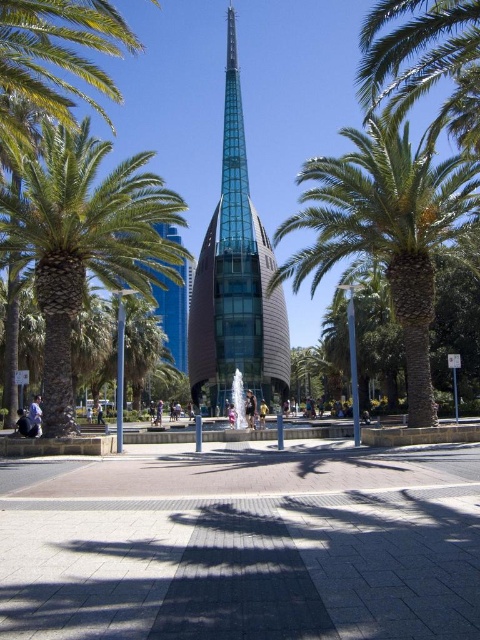
You are a city planner assessing the urban space. You need to determine if the green leafy palm tree at left and the transparent glass spire at center can be positioned without blocking each other. Based on their widths, which one is wider?

The green leafy palm tree at left is wider than the transparent glass spire at center, as its width surpasses that of the spire.

You are standing in the urban scene and want to take a photo of the green leafy palm tree at left and the green leafy palm tree at center. Which palm tree is closer to you?

The green leafy palm tree at left is positioned over the green leafy palm tree at center, so the green leafy palm tree at left is closer to you.